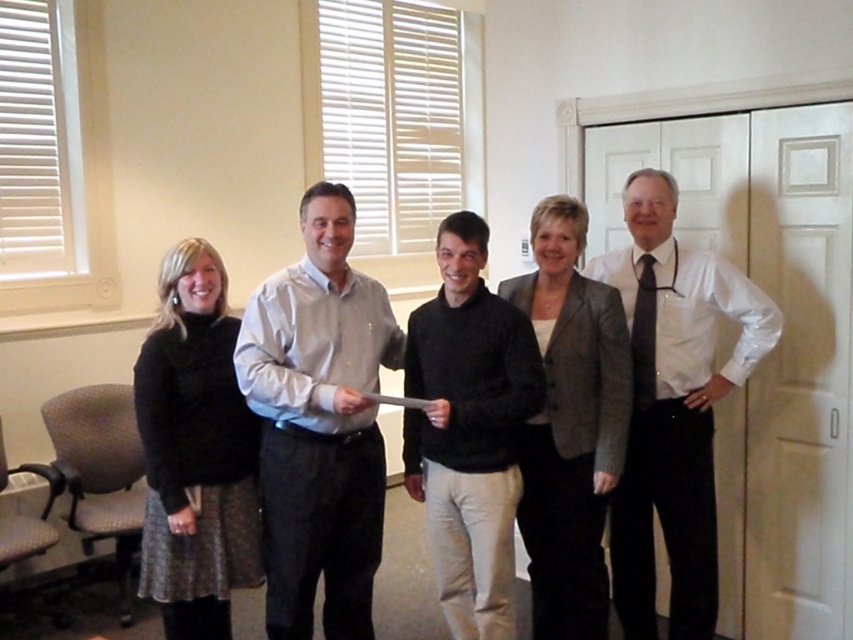
Can you confirm if black sweater at center is wider than dark blue silk tie at right?

Correct, the width of black sweater at center exceeds that of dark blue silk tie at right.

Does black sweater at center appear on the left side of dark blue silk tie at right?

Indeed, black sweater at center is positioned on the left side of dark blue silk tie at right.

Who is more forward, (434, 298) or (646, 374)?

Positioned in front is point (434, 298).

In order to click on black sweater at center in this screenshot , I will do `click(469, 429)`.

From the picture: Does black matte sweater at center appear over dark blue silk tie at right?

No, black matte sweater at center is not above dark blue silk tie at right.

Which is above, black matte sweater at center or dark blue silk tie at right?

dark blue silk tie at right is above.

The image size is (853, 640). What do you see at coordinates (706, 436) in the screenshot?
I see `black matte sweater at center` at bounding box center [706, 436].

You are a GUI agent. You are given a task and a screenshot of the screen. Output one action in this format:
    pyautogui.click(x=<x>, y=<y>)
    Task: Click on the black matte sweater at center
    
    Given the screenshot: What is the action you would take?
    pos(706,436)

Can you confirm if black sweater at center is taller than black matte sweater at center?

No, black sweater at center is not taller than black matte sweater at center.

The image size is (853, 640). What do you see at coordinates (469, 429) in the screenshot? I see `black sweater at center` at bounding box center [469, 429].

What do you see at coordinates (469, 429) in the screenshot? I see `black sweater at center` at bounding box center [469, 429].

Identify the location of black sweater at center. (469, 429).